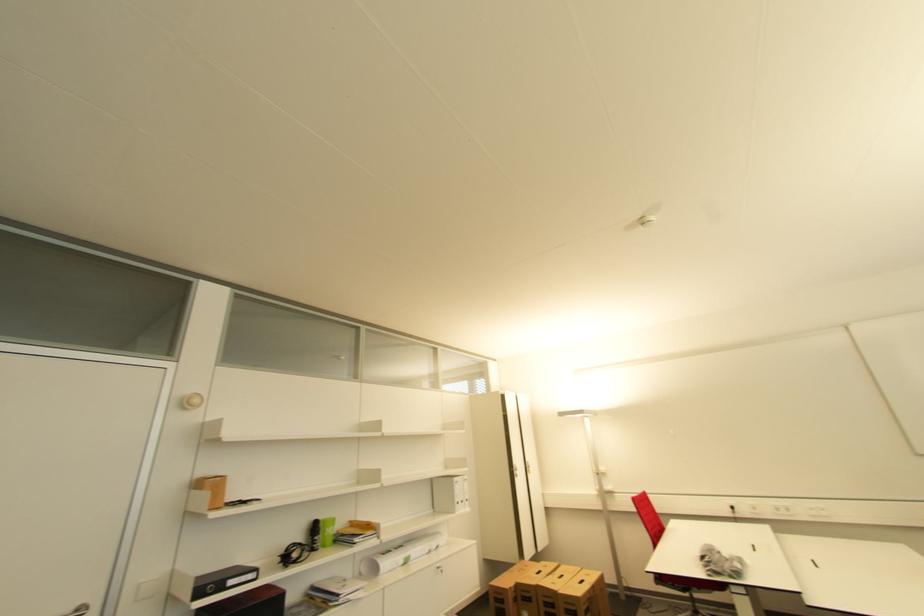
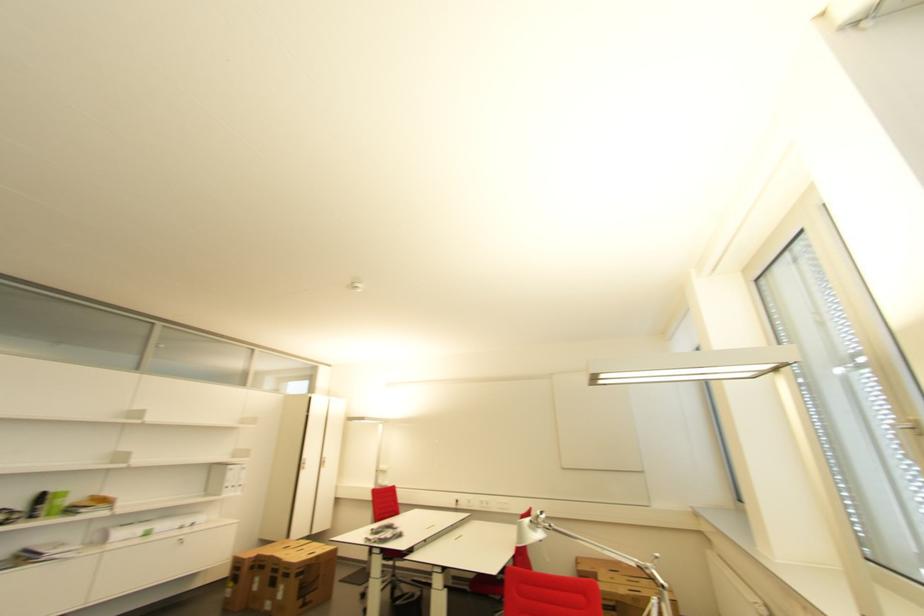
In a continuous first-person perspective shot, in which direction is the camera moving?

The cameraman moved toward right, backward.